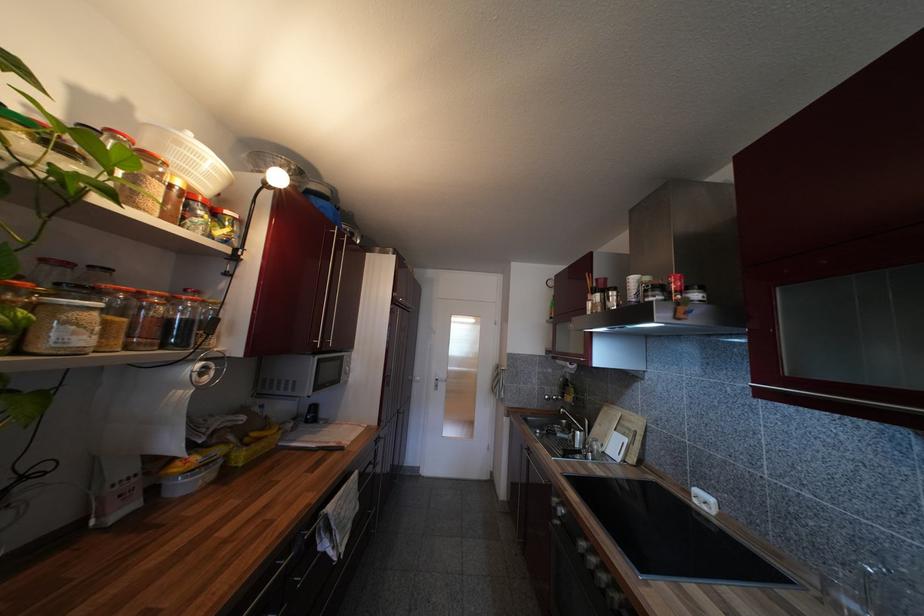
The location [617,434] corresponds to which object?

It corresponds to the white cutting board in the image.